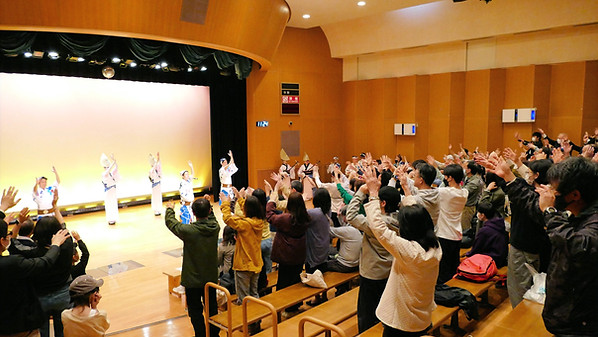
This screenshot has width=598, height=337. Identify the location of box. (399, 130).